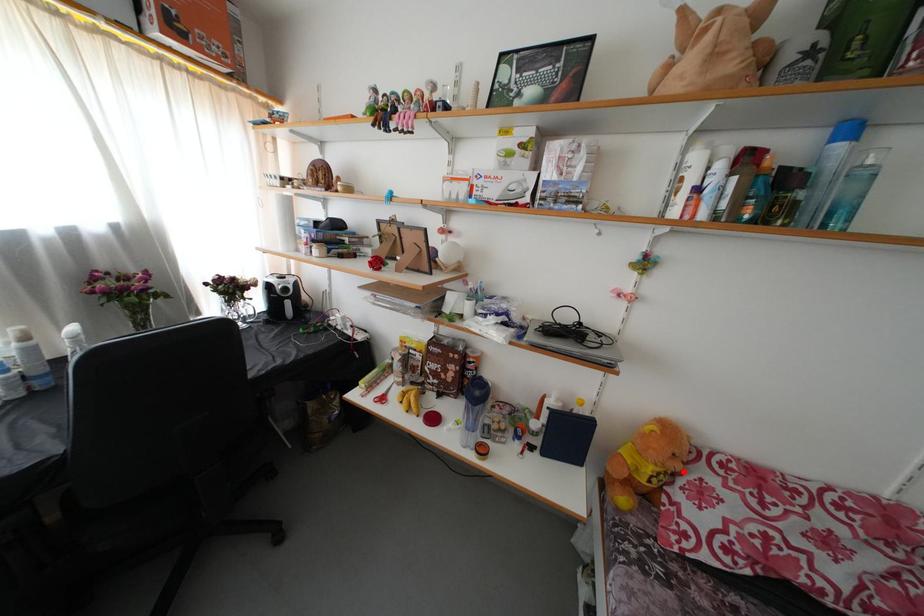
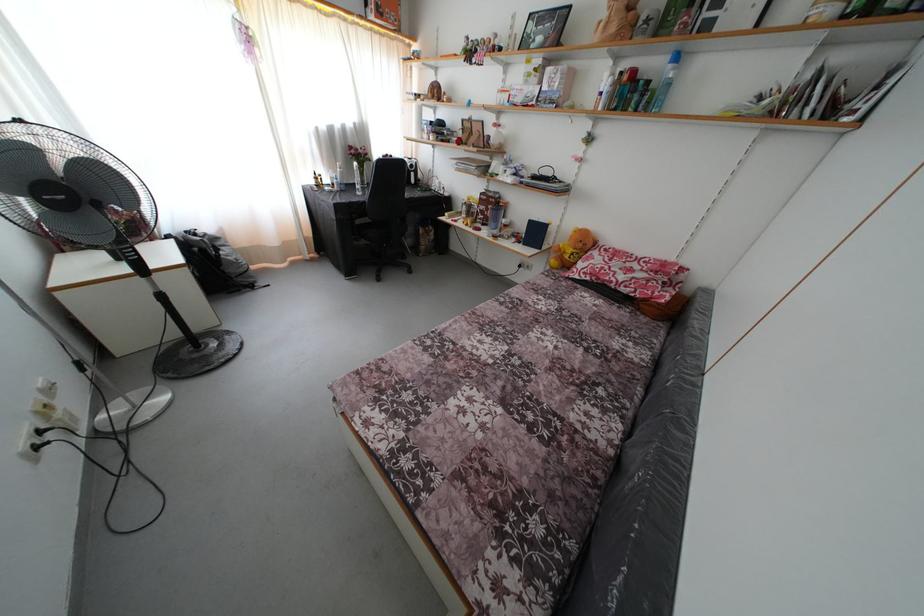
Question: I am providing you with two images of the same scene from different viewpoints. A red point is shown in image1. For the corresponding object point in image2, is it positioned nearer or farther from the camera?

Choices:
 (A) Nearer
 (B) Farther

Answer: (A)